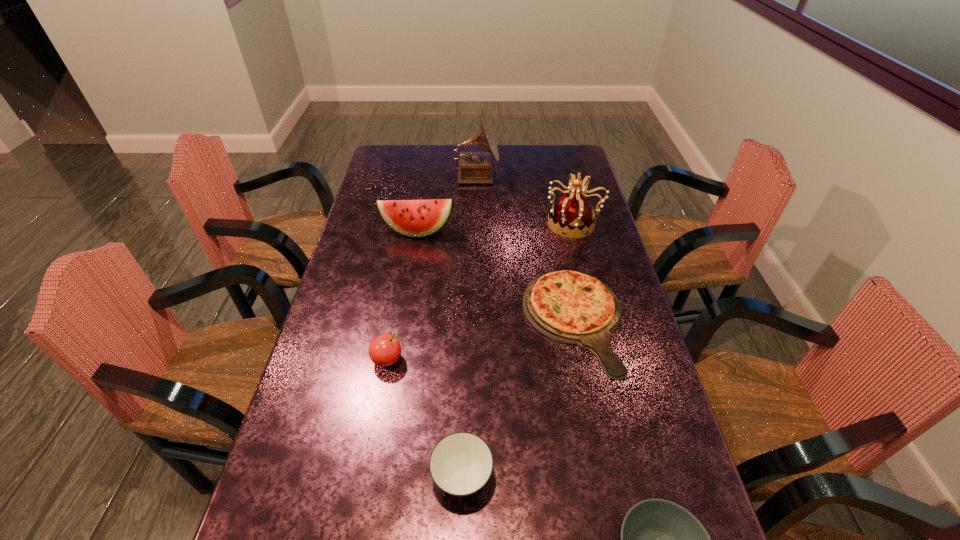
This screenshot has height=540, width=960. What are the coordinates of `the tallest object` in the screenshot? It's located at pos(474,167).

At what (x,y) coordinates should I click in order to perform the action: click on phonograph record. Please return your answer as a coordinate pair (x, y). This screenshot has height=540, width=960. Looking at the image, I should click on (474, 167).

At what (x,y) coordinates should I click in order to perform the action: click on the second tallest object. Please return your answer as a coordinate pair (x, y). The height and width of the screenshot is (540, 960). Looking at the image, I should click on (573, 215).

I want to click on watermelon, so click(415, 218).

Identify the location of apple. The image size is (960, 540). (385, 350).

At what (x,y) coordinates should I click in order to perform the action: click on the farther soup bowl. Please return your answer as a coordinate pair (x, y). This screenshot has height=540, width=960. Looking at the image, I should click on (461, 463).

Locate an element on the screen. This screenshot has width=960, height=540. the sixth farthest object is located at coordinates (461, 463).

Find the location of a particular element. the shortest object is located at coordinates (570, 307).

I want to click on free spot located on the horn of the tallest object, so click(528, 177).

Identify the location of free region located on the front-facing side of the second tallest object. This screenshot has width=960, height=540. (439, 223).